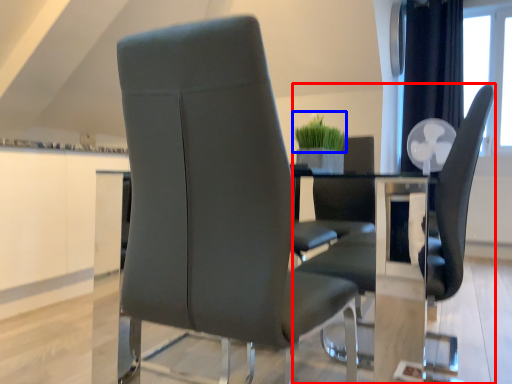
Question: Which object appears closest to the camera in this image, chair (highlighted by a red box) or plant (highlighted by a blue box)?

Choices:
 (A) chair
 (B) plant

Answer: (A)